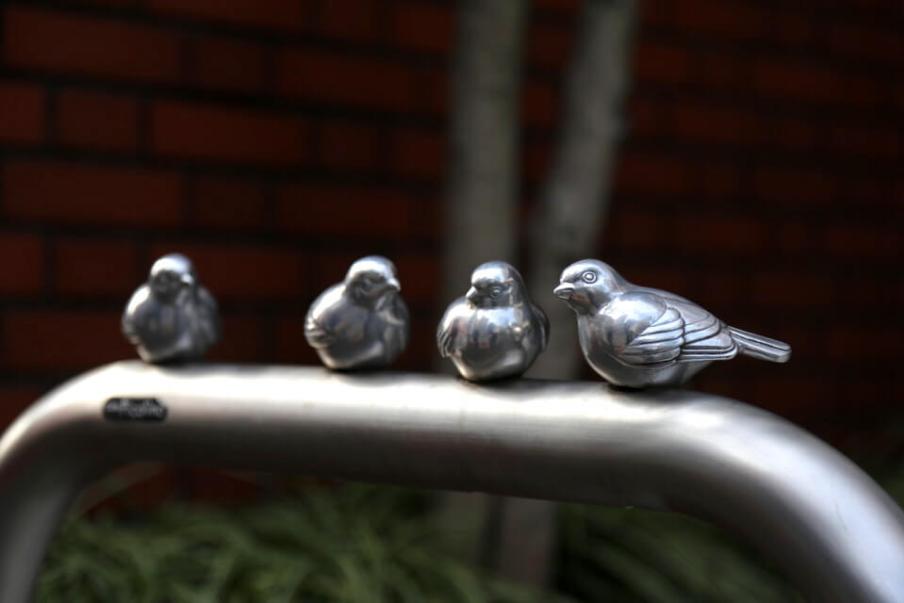
Where is `white light`? This screenshot has width=904, height=603. white light is located at coordinates (399, 388).